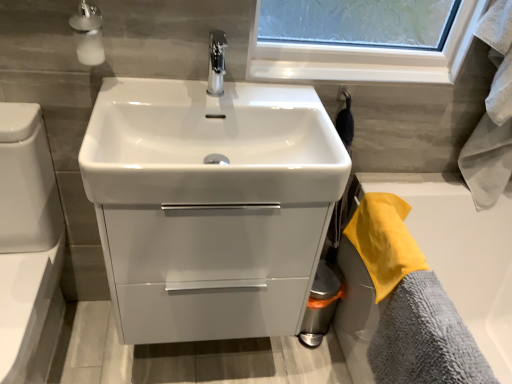
Question: Is point (356, 246) closer or farther from the camera than point (48, 150)?

Choices:
 (A) farther
 (B) closer

Answer: (A)

Question: Is yellow terry cloth towel at right, which appears as the 1th bath towel when viewed from the top, to the left or to the right of white glossy toilet bowl at lower left in the image?

Choices:
 (A) left
 (B) right

Answer: (B)

Question: Estimate the real-world distances between objects in this image. Which object is farther from the gray microfiber towel at lower right, the 2th bath towel from the top?

Choices:
 (A) yellow terry cloth towel at right, placed as the 2th bath towel when sorted from bottom to top
 (B) satin glass soap dispenser at upper left
 (C) white glossy toilet bowl at lower left
 (D) white glossy sink at center

Answer: (B)

Question: Based on their relative distances, which object is nearer to the yellow terry cloth towel at right, placed as the 2th bath towel when sorted from bottom to top?

Choices:
 (A) white glossy sink at center
 (B) satin glass soap dispenser at upper left
 (C) white glossy toilet bowl at lower left
 (D) gray microfiber towel at lower right, marked as the 1th bath towel in a bottom-to-top arrangement

Answer: (D)